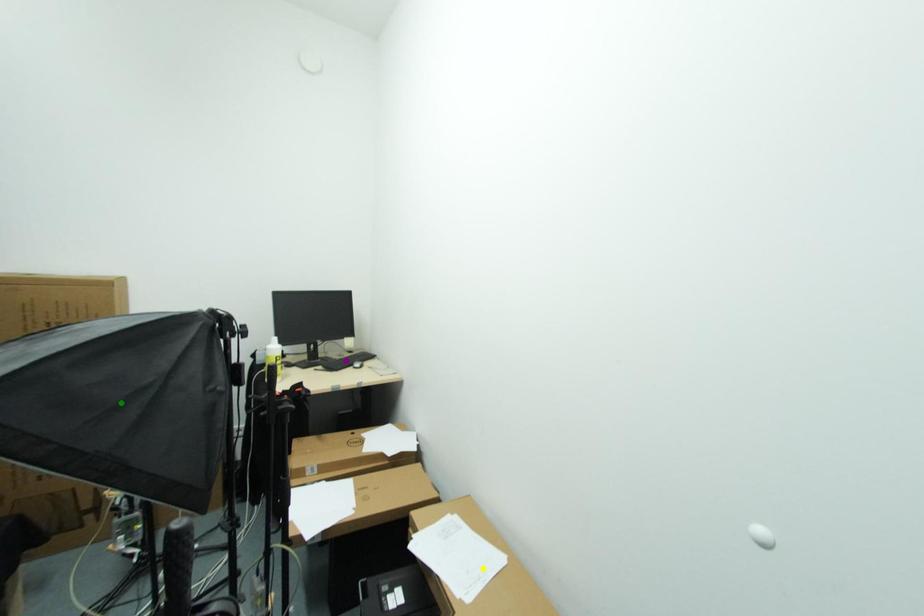
Order these from nearest to farthest:
yellow point
green point
purple point

yellow point
green point
purple point